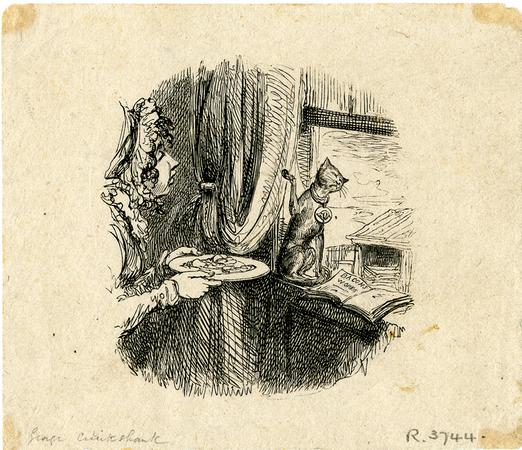
Locate an element on the screen. curtain is located at coordinates (219, 209).